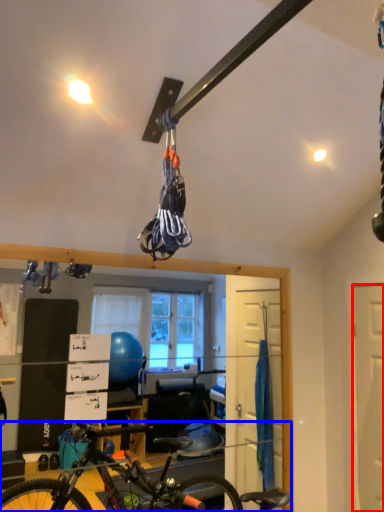
Question: Which object is further to the camera taking this photo, door (highlighted by a red box) or bicycle (highlighted by a blue box)?

Choices:
 (A) door
 (B) bicycle

Answer: (A)